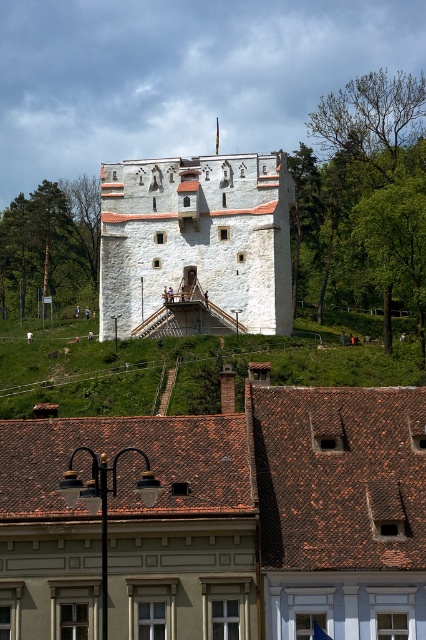
Is point (138, 301) positioned before point (380, 116)?

Yes.

Locate an element on the screen. The height and width of the screenshot is (640, 426). white stone tower at center is located at coordinates click(x=195, y=244).

Does green leafy tree at upper center lie behind green leafy tree at left?

No.

You are a GUI agent. You are given a task and a screenshot of the screen. Output one action in this format:
    pyautogui.click(x=<x>, y=<y>)
    Task: Click on the green leafy tree at upper center
    This screenshot has height=640, width=426.
    Given the screenshot: What is the action you would take?
    pyautogui.click(x=365, y=195)

Find the location of a particular element. white stone tower at center is located at coordinates (195, 244).

Does white stone tower at center appear over green leafy tree at left?

Incorrect, white stone tower at center is not positioned above green leafy tree at left.

The height and width of the screenshot is (640, 426). In order to click on white stone tower at center in this screenshot , I will do `click(195, 244)`.

I want to click on white stone tower at center, so click(x=195, y=244).